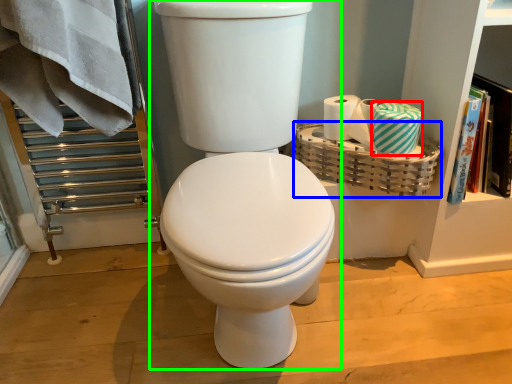
Question: Based on their relative distances, which object is farther from material (highlighted by a red box)? Choose from basket (highlighted by a blue box) and toilet (highlighted by a green box).

Choices:
 (A) basket
 (B) toilet

Answer: (B)